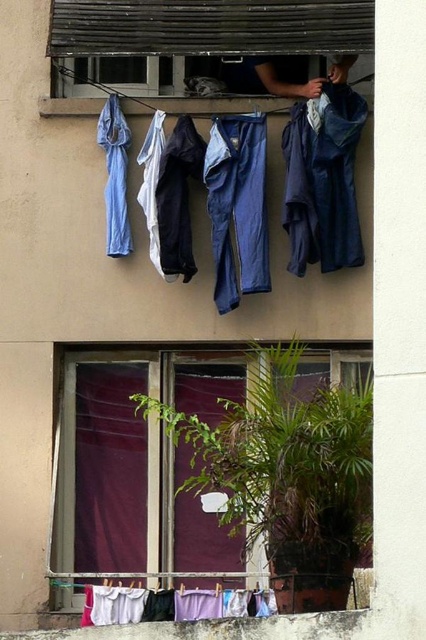
Find the location of a particular element. The height and width of the screenshot is (640, 426). white cotton underwear at lower center is located at coordinates (172, 604).

How far apart are white cotton underwear at lower center and blue fabric pants at upper left?

They are 2.71 meters apart.

Which is in front, point (203, 608) or point (115, 230)?

Point (203, 608)

Image resolution: width=426 pixels, height=640 pixels. Identify the location of white cotton underwear at lower center. (x=172, y=604).

Does purple matte curtain at lower left have a greater width compared to blue fabric pants at center?

Yes.

Does purple matte curtain at lower left appear on the right side of blue fabric pants at center?

Incorrect, purple matte curtain at lower left is not on the right side of blue fabric pants at center.

The image size is (426, 640). In order to click on purple matte curtain at lower left in this screenshot , I will do `click(109, 468)`.

Consider the image. Is maroon fabric curtain at lower center to the left of white cotton underwear at lower center from the viewer's perspective?

No, maroon fabric curtain at lower center is not to the left of white cotton underwear at lower center.

Can you confirm if maroon fabric curtain at lower center is bigger than white cotton underwear at lower center?

Yes.

The width and height of the screenshot is (426, 640). I want to click on maroon fabric curtain at lower center, so click(284, 474).

Image resolution: width=426 pixels, height=640 pixels. I want to click on maroon fabric curtain at lower center, so click(x=284, y=474).